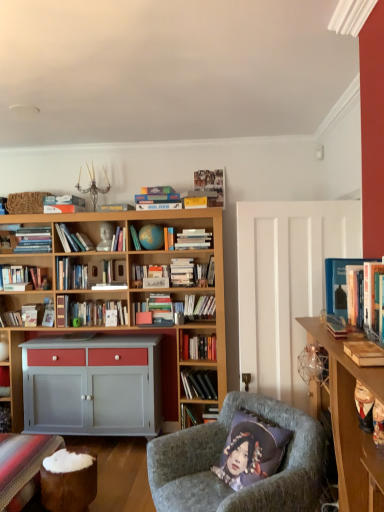
This screenshot has width=384, height=512. I want to click on vacant space situated above hardcover book at left, the 12th book positioned from the front (from a real-world perspective), so click(x=24, y=265).